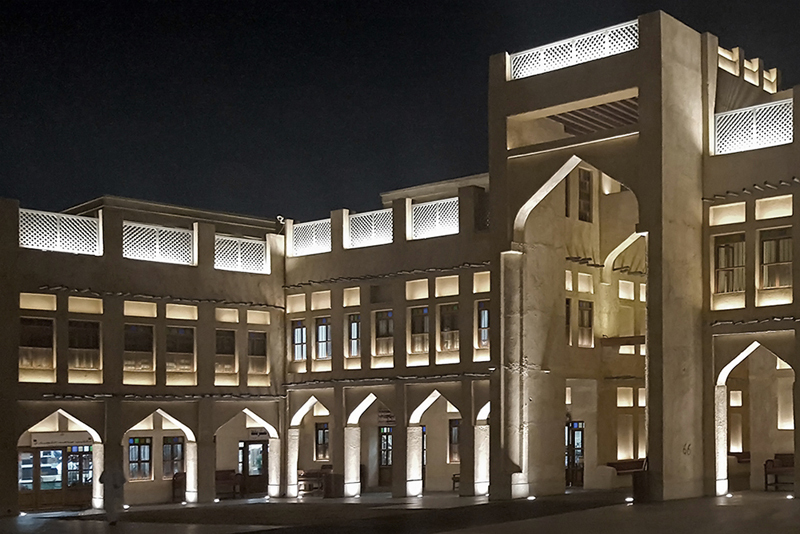
Locate an element on the screen. The height and width of the screenshot is (534, 800). floor is located at coordinates (360, 519).